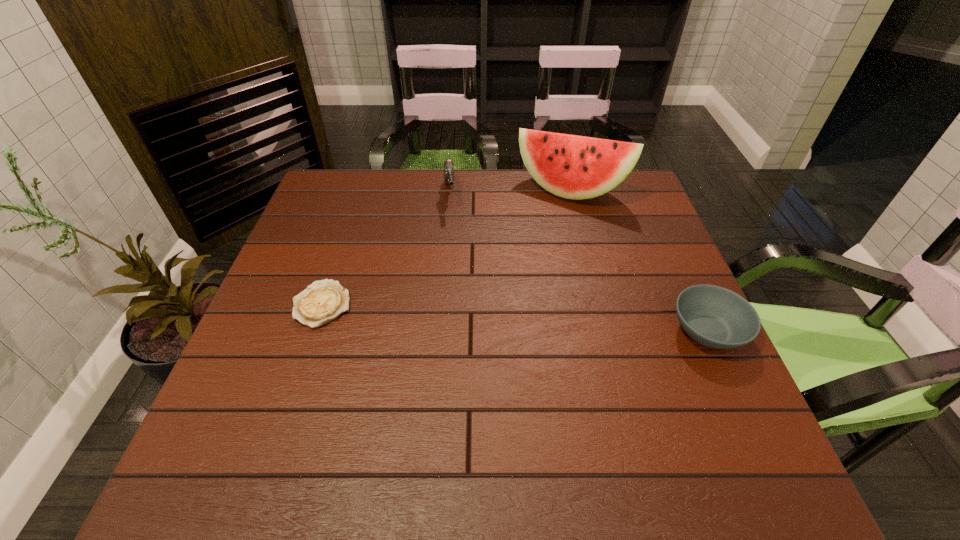
Where is `free space on the desktop that is between the leftmost object and the soup bowl and is positioned at the barrel of the pistol`? free space on the desktop that is between the leftmost object and the soup bowl and is positioned at the barrel of the pistol is located at coordinates click(465, 314).

Where is `free spot on the desktop that is between the shortest object and the second shortest object and is positioned on the outer rind of the tallest object`? Image resolution: width=960 pixels, height=540 pixels. free spot on the desktop that is between the shortest object and the second shortest object and is positioned on the outer rind of the tallest object is located at coordinates (516, 318).